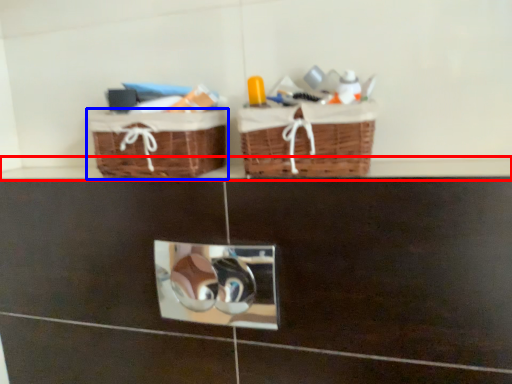
Question: Which point is further to the camera, ledge (highlighted by a red box) or picnic basket (highlighted by a blue box)?

Choices:
 (A) ledge
 (B) picnic basket

Answer: (B)